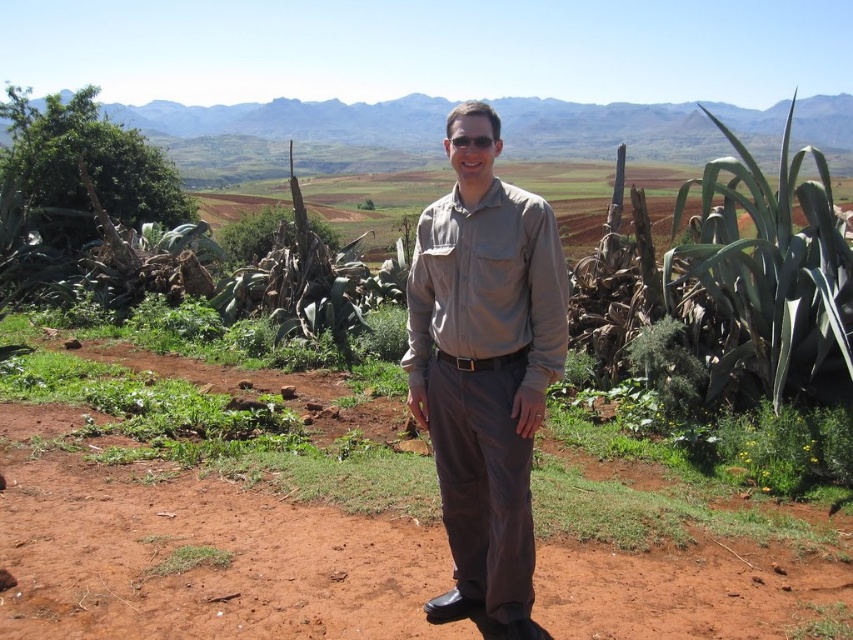
You are a drone operator tasked with capturing aerial footage of the matte khaki shirt at center and the green grass at lower left. Your drone has a camera with a 100mm lens that can focus on objects within a range of 4 feet to 5 feet away. Can the drone capture both objects in focus simultaneously?

The distance between the matte khaki shirt at center and the green grass at lower left is 4.83 feet, which falls within the 4 to 5 feet range of the drone camera. Therefore, the drone can capture both objects in focus simultaneously.

You are a photographer standing at a certain distance from the person wearing the matte khaki shirt at center. You want to capture a closeup shot of their facial expression without using a zoom lens. What is the minimum distance you need to move closer to the subject?

The matte khaki shirt at center is 3.45 meters away from the camera. To capture a closeup shot without a zoom lens, you would need to move closer to reduce the distance between the camera and the subject. The exact minimum distance depends on the camera sensor size and lens focal length, but generally, moving to within 1 meter or closer would allow for a closeup.

Based on the photo, you are a fashion designer observing the scene. You notice the matte khaki shirt at center and the green grass at lower left. Which object takes up more visual space in the image?

The matte khaki shirt at center is larger in size than the green grass at lower left, so it takes up more visual space.